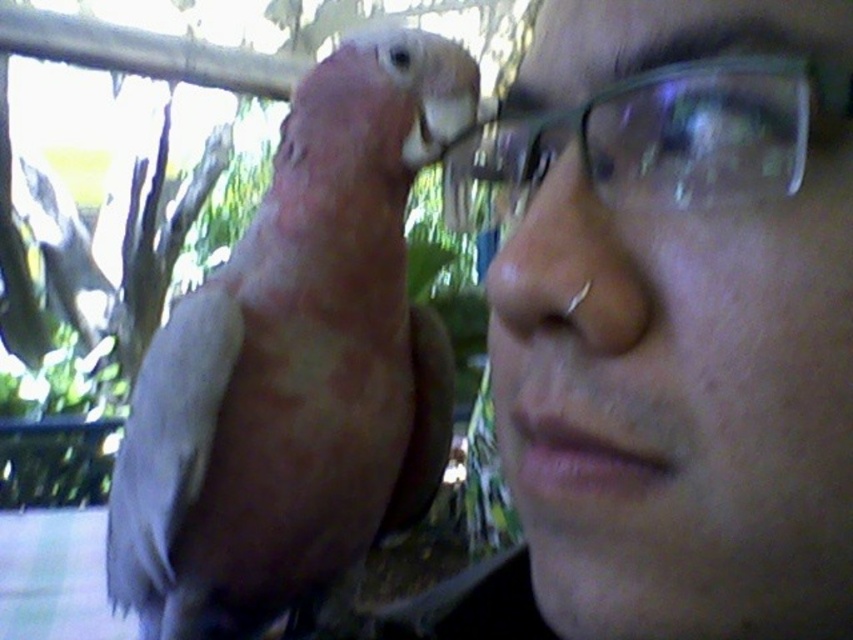
Question: Which of the following is the farthest from the observer?

Choices:
 (A) (555, 470)
 (B) (134, 604)
 (C) (511, 134)

Answer: (B)

Question: Which point appears closest to the camera in this image?

Choices:
 (A) (686, 186)
 (B) (846, 456)
 (C) (331, 376)

Answer: (B)

Question: Which point appears farthest from the camera in this image?

Choices:
 (A) (120, 468)
 (B) (531, 227)
 (C) (640, 497)

Answer: (A)

Question: Considering the relative positions of clear glass glasses at upper right and matte pink parrot at upper left in the image provided, where is clear glass glasses at upper right located with respect to matte pink parrot at upper left?

Choices:
 (A) right
 (B) left

Answer: (A)

Question: Is clear glass glasses at upper right positioned at the back of clear plastic glasses at upper center?

Choices:
 (A) yes
 (B) no

Answer: (B)

Question: Observing the image, what is the correct spatial positioning of matte pink parrot at upper left in reference to matte pink beak at lower left?

Choices:
 (A) below
 (B) above

Answer: (A)